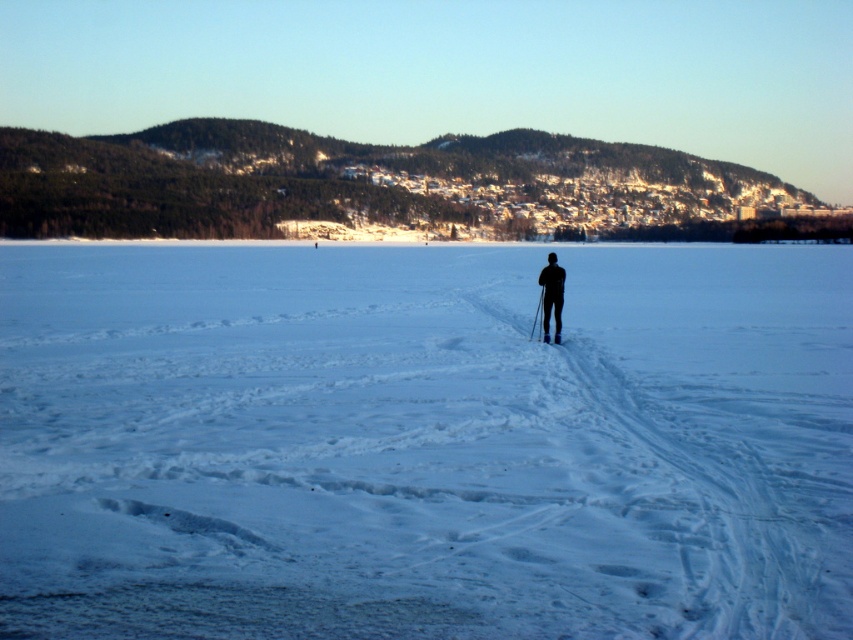
You are planning to take a photo of the winter landscape. The scene includes the white powder snow at center and the black matte skier at center. Which object will occupy more horizontal space in the photo?

The white powder snow at center will occupy more horizontal space in the photo because its width surpasses that of the black matte skier at center.

You are a photographer planning to capture the winter landscape. You want to ensure the black matte skier at center is visible against the white powder snow at center. Based on their positions, which object should you focus on to ensure the contrast between them?

The white powder snow at center is positioned on the right side of black matte skier at center. To ensure contrast, focus on the black matte skier at center as it provides a dark silhouette against the bright snow.